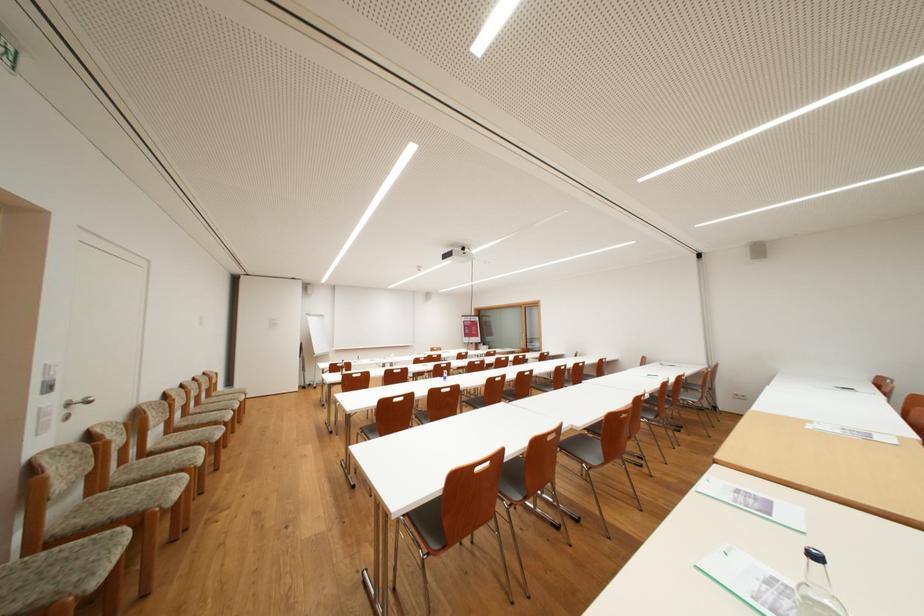
Find where to lift the green paper leaflet. Please return your answer as a coordinate pair (x, y).

(7, 54)